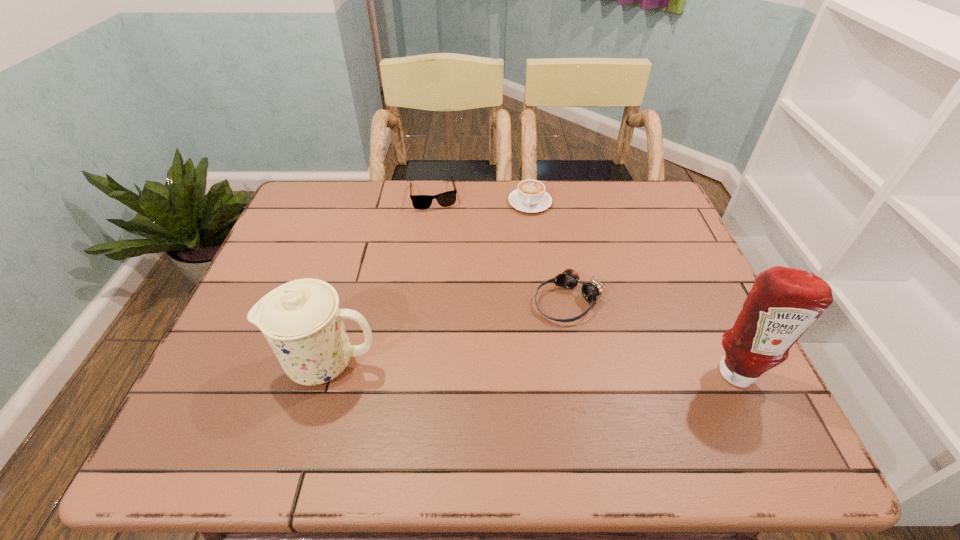
I want to click on vacant space located 0.290m on the side of the cappuccino with the handle, so click(510, 283).

This screenshot has height=540, width=960. I want to click on vacant position located on the side of the cappuccino with the handle, so click(x=508, y=291).

I want to click on blank space located 0.230m through the lenses of the third nearest object, so click(x=480, y=380).

Locate an element on the screen. The width and height of the screenshot is (960, 540). vacant region located through the lenses of the third nearest object is located at coordinates (514, 349).

What are the coordinates of `vacant position located 0.050m through the lenses of the third nearest object` in the screenshot? It's located at (534, 330).

I want to click on free space located 0.190m on the front-facing side of the sunglasses, so click(x=447, y=252).

Find the location of a particular element. The width and height of the screenshot is (960, 540). vacant space located on the front-facing side of the sunglasses is located at coordinates (448, 257).

The image size is (960, 540). Identify the location of free space located 0.390m on the front-facing side of the sunglasses. (462, 306).

Locate an element on the screen. cappuccino at the far edge is located at coordinates (530, 196).

The height and width of the screenshot is (540, 960). Identify the location of sunglasses that is positioned at the far edge. (421, 202).